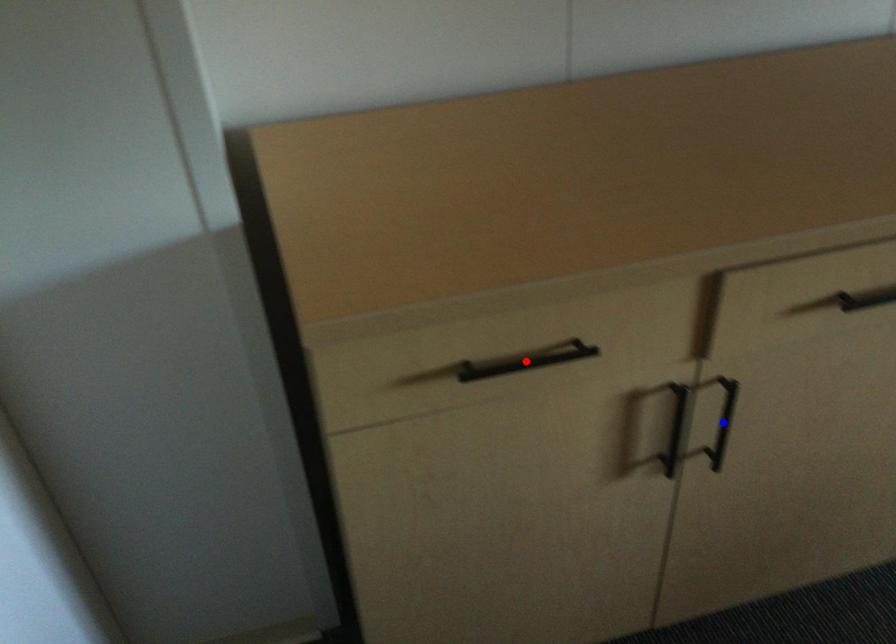
Question: Which of the two points in the image is closer to the camera?

Choices:
 (A) Blue point is closer.
 (B) Red point is closer.

Answer: (B)